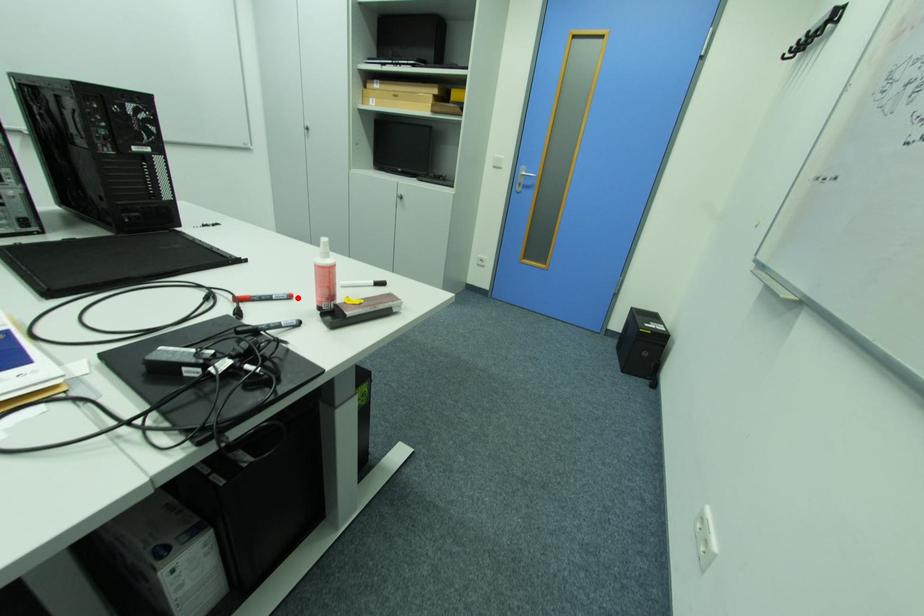
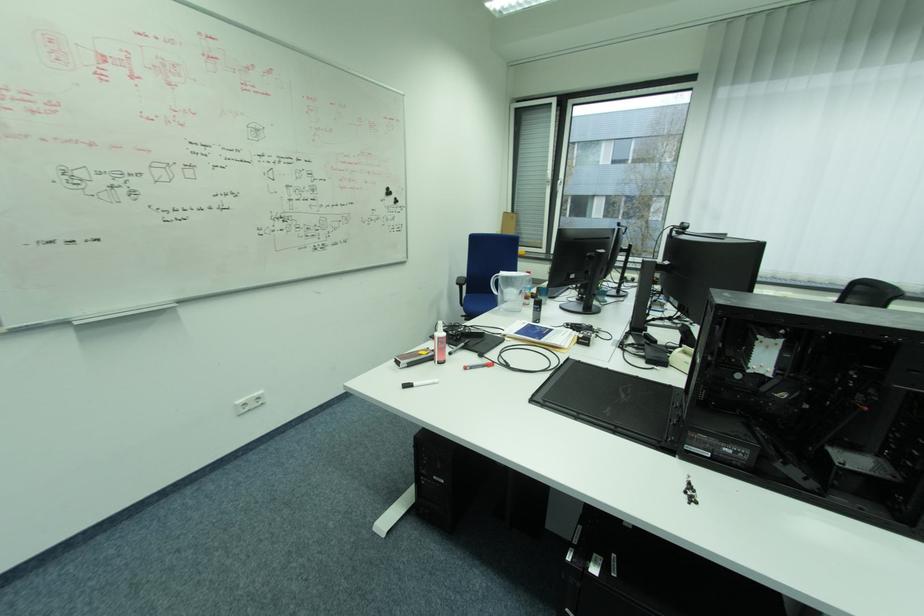
Find the pixel in the second image that matches the highlighted location in the first image.

(472, 369)